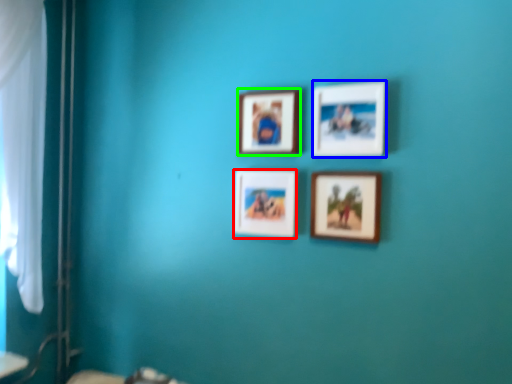
Question: Which object is positioned closest to picture frame (highlighted by a red box)? Select from picture frame (highlighted by a blue box) and picture frame (highlighted by a green box).

Choices:
 (A) picture frame
 (B) picture frame

Answer: (B)